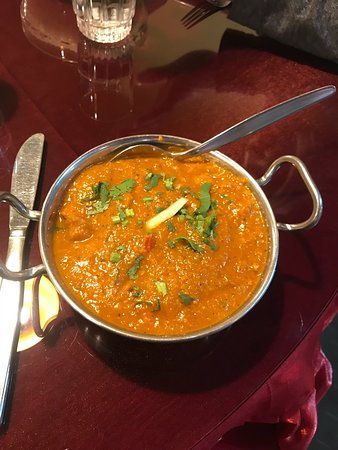
The height and width of the screenshot is (450, 338). Find the location of `glass`. glass is located at coordinates (111, 18).